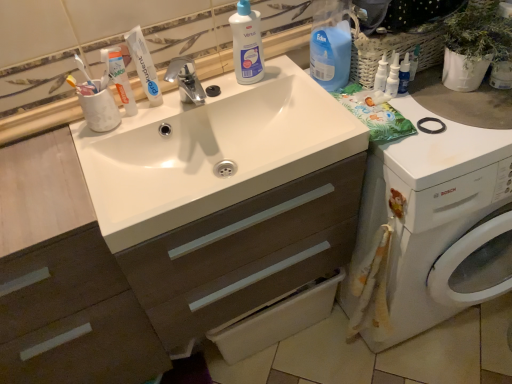
Question: Is white glossy sink at center inside or outside of white glossy toothpaste tube at upper left?

Choices:
 (A) inside
 (B) outside

Answer: (B)

Question: Is white glossy sink at center wider or thinner than white glossy toothpaste tube at upper left?

Choices:
 (A) wide
 (B) thin

Answer: (A)

Question: Which is nearer to the white glossy toothpaste at upper left?

Choices:
 (A) yellow-bristled toothbrush at upper left
 (B) white glossy spray bottle at upper right, placed as the 1th cleaning product when sorted from right to left
 (C) white glossy toothpaste tube at upper left
 (D) white glossy sink at center
 (E) blue plastic bottle at upper right, acting as the second cleaning product starting from the left

Answer: (C)

Question: Which object is positioned closest to the white glossy toothpaste tube at upper left?

Choices:
 (A) white glossy sink at center
 (B) white glossy toothpaste at upper left
 (C) white plastic washing machine at right
 (D) blue plastic bottle at upper right, acting as the second cleaning product starting from the left
 (E) white glossy spray bottle at upper right, positioned as the second cleaning product in right-to-left order

Answer: (B)